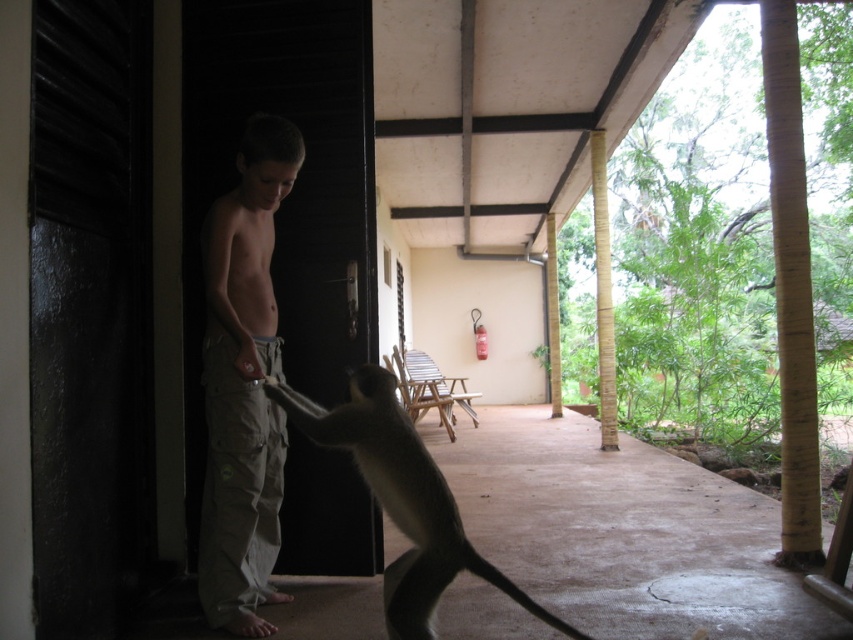
Based on the photo, you are a photographer trying to capture the interaction between the tan cargo pants at center and the brown furry tail at lower center. Based on their positions, which one should you focus on first to ensure both are in frame?

The tan cargo pants at center is above the brown furry tail at lower center, so you should focus on the brown furry tail at lower center first to ensure both are in frame.

You are standing on the porch and want to throw a ball to the monkey. The monkey is at point (212, 564) and the boy is at point (606, 323). Which point is closer to you?

Point (212, 564) is in front of point (606, 323), so it is closer to you.

You are a delivery person trying to place a package on the ground between the tan cargo pants at center and the bamboo pole at right. The package requires 3 meters of space to be safely placed. Can you fit the package in that space?

The distance between the tan cargo pants at center and the bamboo pole at right is 4.75 meters. Since the package needs 3 meters of space, there is enough room to safely place it between them.